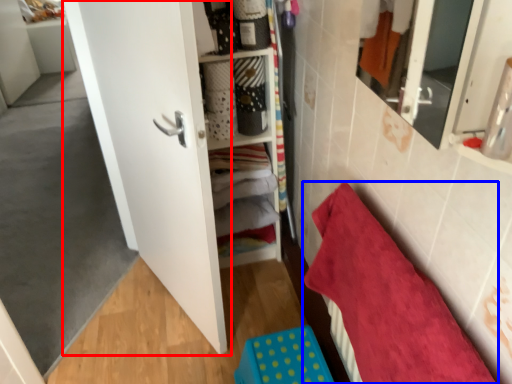
Question: Among these objects, which one is nearest to the camera, door (highlighted by a red box) or towel (highlighted by a blue box)?

Choices:
 (A) door
 (B) towel

Answer: (B)